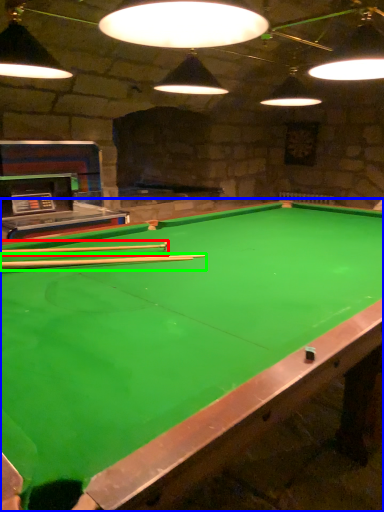
Question: Based on their relative distances, which object is farther from cue (highlighted by a red box)? Choose from billiard table (highlighted by a blue box) and cue (highlighted by a green box).

Choices:
 (A) billiard table
 (B) cue

Answer: (A)